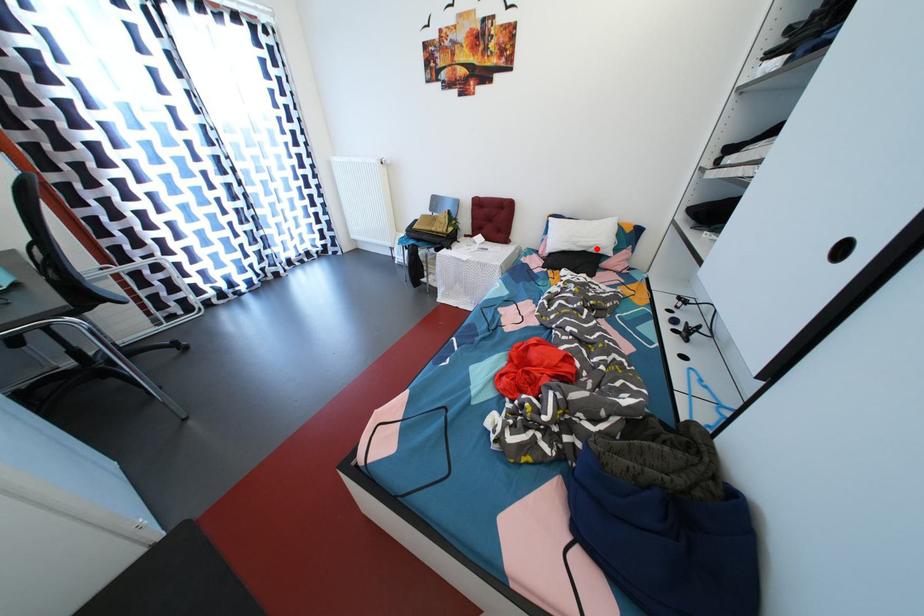
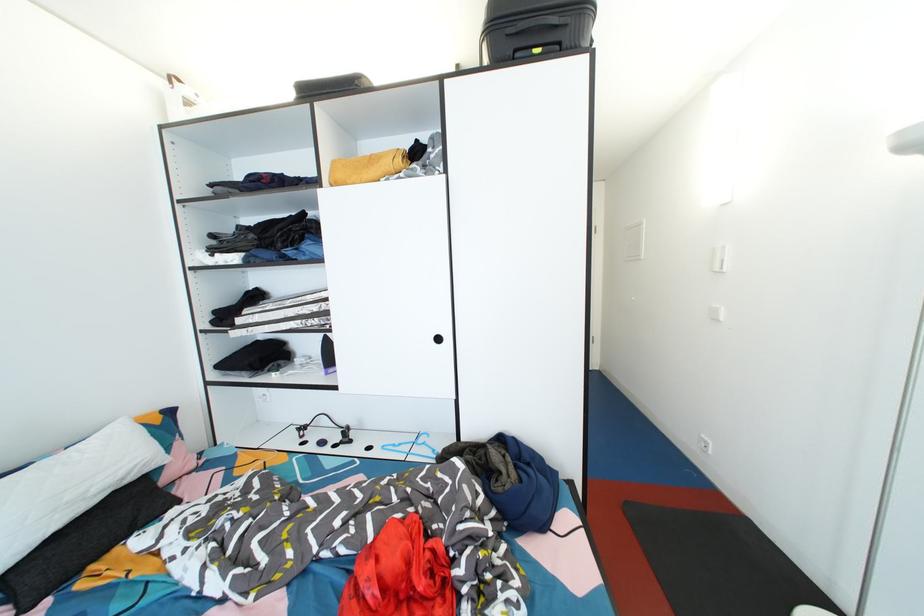
Find the pixel in the second image that matches the highlighted location in the first image.

(128, 477)